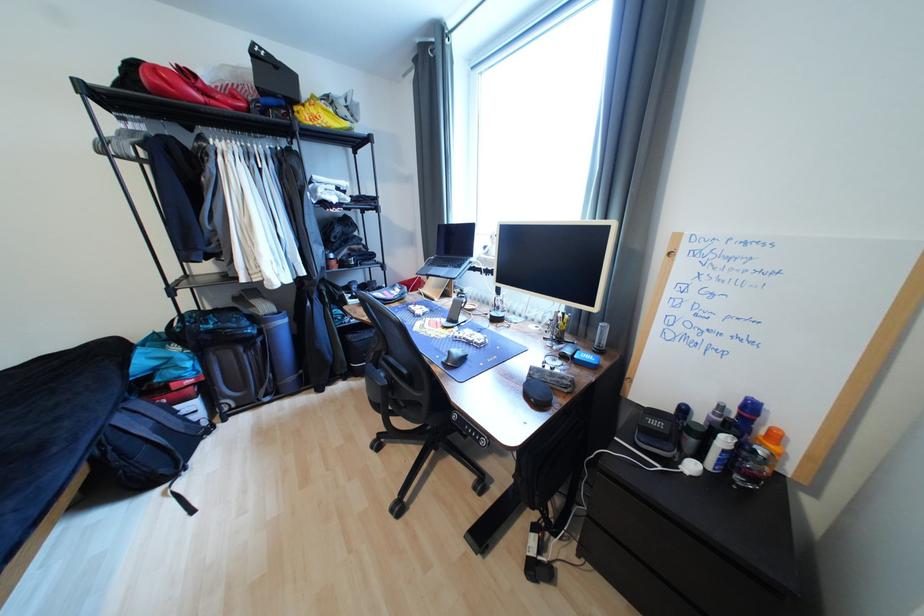
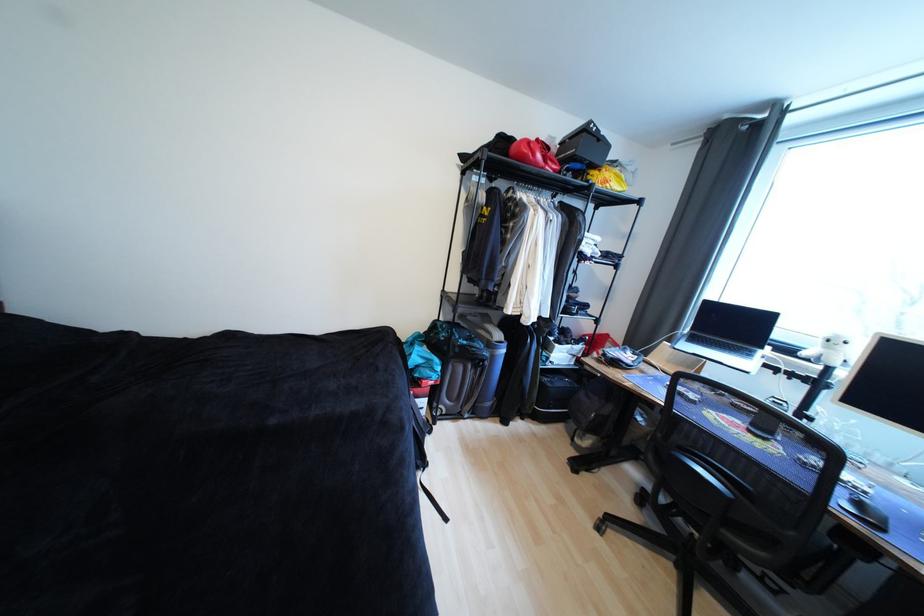
The point at (167, 92) is marked in the first image. Where is the corresponding point in the second image?

(529, 159)